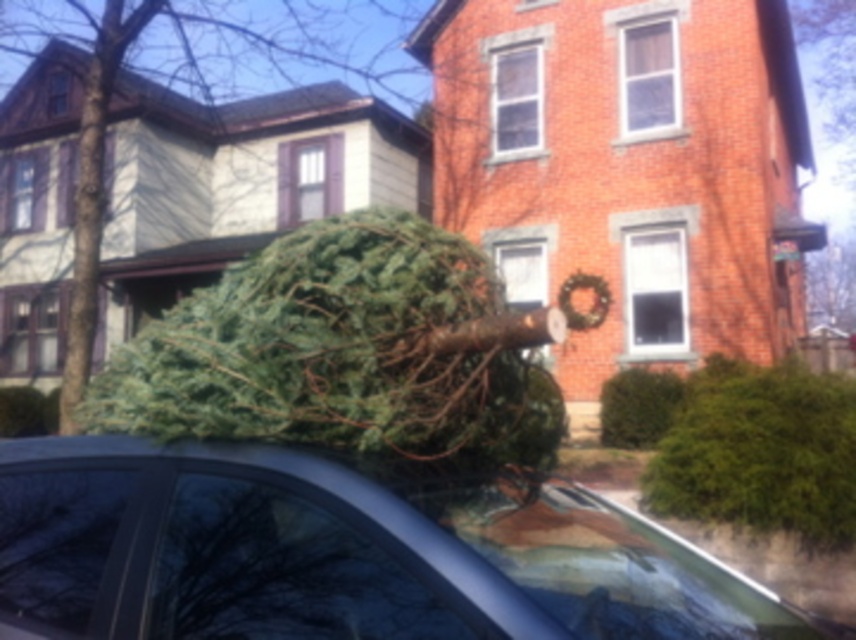
You are a pedestrian standing on the sidewalk across from the metallic gray car at center and the green rough textured tree at center. Which object is closer to the sidewalk?

The green rough textured tree at center is closer to the sidewalk because the metallic gray car at center is to the right of it, placing the tree nearer to the pedestrian.

You are standing at the point with coordinates point (164, 193). What object are you directly facing?

The point (164, 193) corresponds to the green rough textured tree at center, so you are directly facing the green rough textured tree at center.

You are standing in the middle of the residential street and want to place a decoration on the green rough textured tree at center. Based on the coordinates provided, in which direction should you walk to reach the tree?

The green rough textured tree at center is located at coordinates point (164, 193), which means it is positioned to the lower left of the image. Therefore, you should walk towards the lower left direction to reach the tree.